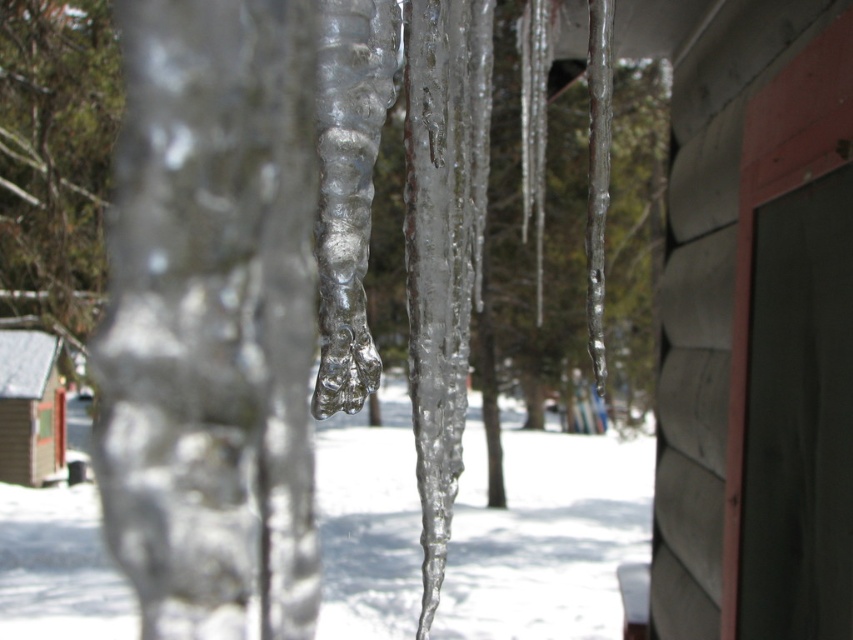
Can you confirm if transparent ice icicles at center is positioned to the left of wooden cabin at lower left?

Incorrect, transparent ice icicles at center is not on the left side of wooden cabin at lower left.

Who is taller, transparent ice icicles at center or wooden cabin at lower left?

wooden cabin at lower left

Which is behind, point (500, 540) or point (35, 436)?

Point (35, 436)

Where is `transparent ice icicles at center`? This screenshot has height=640, width=853. transparent ice icicles at center is located at coordinates (544, 534).